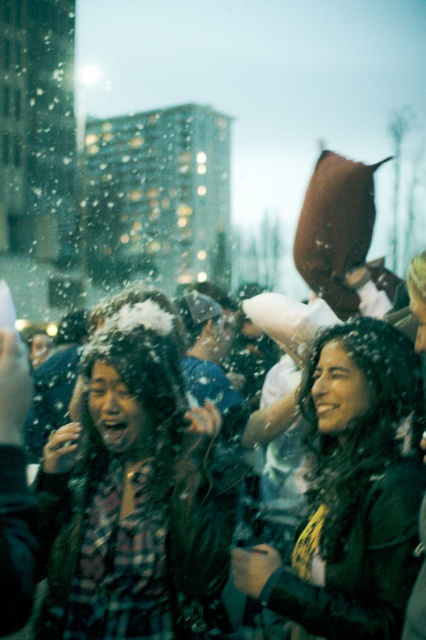
You are a photographer trying to capture the festive atmosphere. You notice the plaid fabric scarf at center and the shiny black jacket at center. Which object is wider when viewed from your camera position?

The plaid fabric scarf at center is wider than the shiny black jacket at center.

You are standing in the snowy urban scene and want to reach the point marked at coordinates point (x=98, y=552). If you can walk 3 feet per second, how many seconds will it take you to reach that point?

The distance between you and point (x=98, y=552) is 8.20 feet. At a walking speed of 3 feet per second, it would take approximately 2.73 seconds to reach the point.

Looking at this image, you are a photographer trying to capture a closeup shot of the plaid fabric scarf at center and the shiny black jacket at center. Based on their positions, which one should you focus on first to ensure both are in focus?

The plaid fabric scarf at center is located below the shiny black jacket at center, so you should focus on the shiny black jacket at center first to ensure both are in focus since it is closer to the camera.